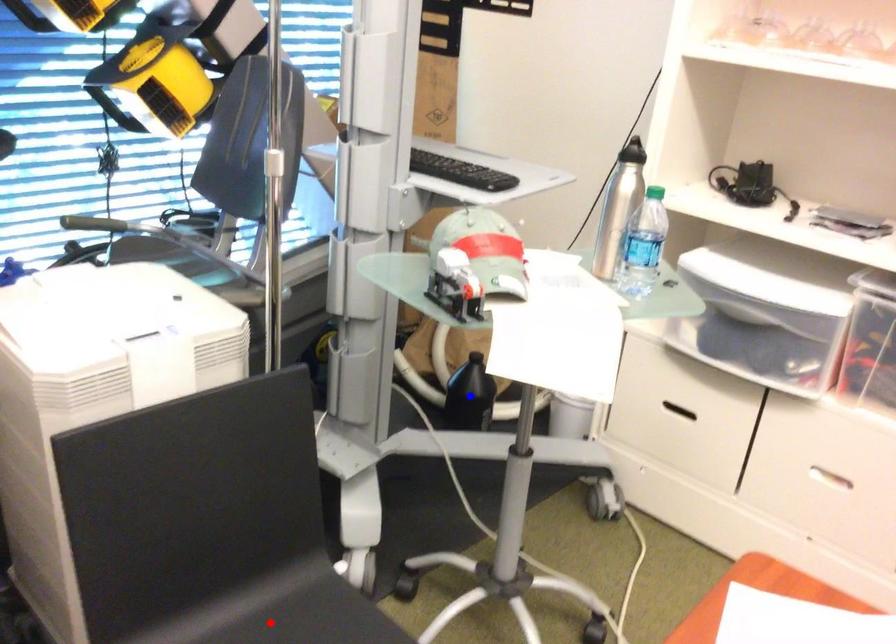
Question: Which of the two points in the image is closer to the camera?

Choices:
 (A) Blue point is closer.
 (B) Red point is closer.

Answer: (B)